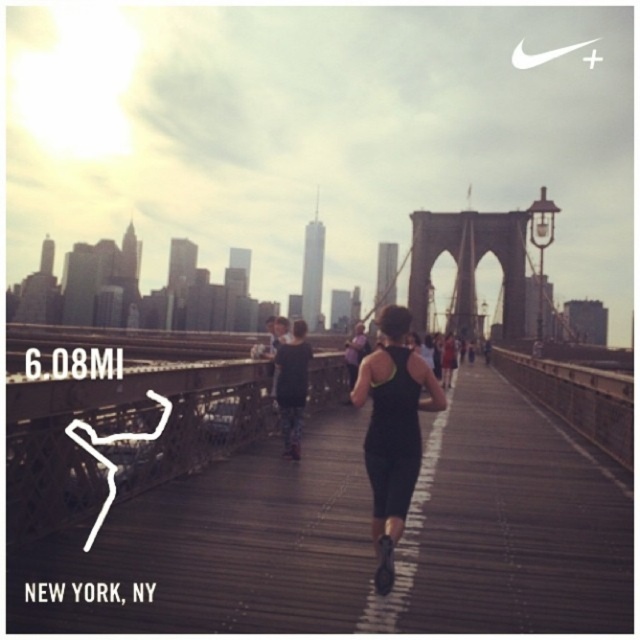
You are standing at the point with coordinates (358, 538) on the Brooklyn Bridge. What object is located exactly at this point?

The black fabric running suit at center is located exactly at point (358, 538).

You are a photographer on the Brooklyn Bridge and notice two runners wearing black running suits. According to the image, which runner, the black fabric running suit at center or the black matte running suit at center, appears closer to you?

The black fabric running suit at center appears closer because it is located below the black matte running suit at center, indicating it is in front in the visual plane.

You are standing on the Brooklyn Bridge and see the dark gray stone bridge at center and the floral leggings at center. Which object is positioned to the right of the other?

The dark gray stone bridge at center is to the right of the floral leggings at center.